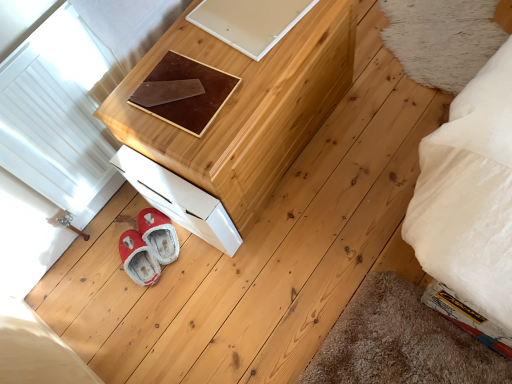
Locate an element on the screen. The width and height of the screenshot is (512, 384). vacant space positioned to the left of fuzzy red slippers at lower left is located at coordinates (88, 274).